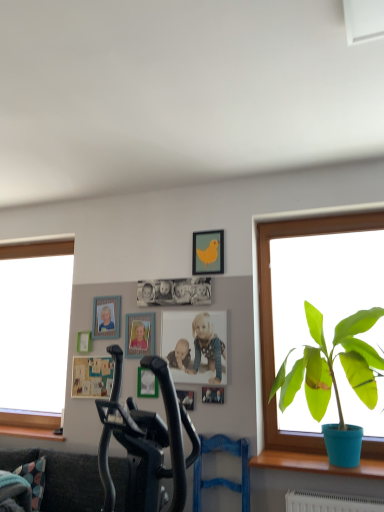
Question: Can you confirm if wooden picture frame at center, the 4th picture frame viewed from the right, is wider than wooden photo frame at upper left, the 3th picture frame in the left-to-right sequence?

Choices:
 (A) no
 (B) yes

Answer: (B)

Question: Does wooden picture frame at center, acting as the fourth picture frame starting from the left, appear on the left side of wooden photo frame at upper left, the 3th picture frame in the left-to-right sequence?

Choices:
 (A) no
 (B) yes

Answer: (A)

Question: Is the position of wooden picture frame at center, the 4th picture frame viewed from the right, less distant than that of wooden photo frame at upper left, which is counted as the fifth picture frame, starting from the right?

Choices:
 (A) no
 (B) yes

Answer: (B)

Question: From the image's perspective, is wooden picture frame at center, acting as the fourth picture frame starting from the left, over wooden photo frame at upper left, which is counted as the fifth picture frame, starting from the right?

Choices:
 (A) no
 (B) yes

Answer: (A)

Question: From the image's perspective, is wooden picture frame at center, acting as the fourth picture frame starting from the left, below wooden photo frame at upper left, the 3th picture frame in the left-to-right sequence?

Choices:
 (A) no
 (B) yes

Answer: (B)

Question: Does wooden picture frame at center, acting as the fourth picture frame starting from the left, lie behind wooden photo frame at upper left, the 3th picture frame in the left-to-right sequence?

Choices:
 (A) yes
 (B) no

Answer: (B)

Question: Does metallic silver photo frame at center, acting as the first picture frame starting from the right, have a lesser height compared to dark gray fabric couch at lower left?

Choices:
 (A) yes
 (B) no

Answer: (A)

Question: Considering the relative sizes of metallic silver photo frame at center, acting as the first picture frame starting from the right, and dark gray fabric couch at lower left in the image provided, is metallic silver photo frame at center, acting as the first picture frame starting from the right, smaller than dark gray fabric couch at lower left?

Choices:
 (A) yes
 (B) no

Answer: (A)

Question: From a real-world perspective, is metallic silver photo frame at center, the 7th picture frame from the left, located higher than dark gray fabric couch at lower left?

Choices:
 (A) no
 (B) yes

Answer: (B)

Question: Is metallic silver photo frame at center, the 7th picture frame from the left, not within dark gray fabric couch at lower left?

Choices:
 (A) yes
 (B) no

Answer: (A)

Question: Can dark gray fabric couch at lower left be found inside metallic silver photo frame at center, the 7th picture frame from the left?

Choices:
 (A) no
 (B) yes

Answer: (A)

Question: From a real-world perspective, is metallic silver photo frame at center, the 7th picture frame from the left, physically below dark gray fabric couch at lower left?

Choices:
 (A) no
 (B) yes

Answer: (A)

Question: From a real-world perspective, is matte photo frame at center over metallic silver picture frame at center, arranged as the fifth picture frame when viewed from the left?

Choices:
 (A) no
 (B) yes

Answer: (B)